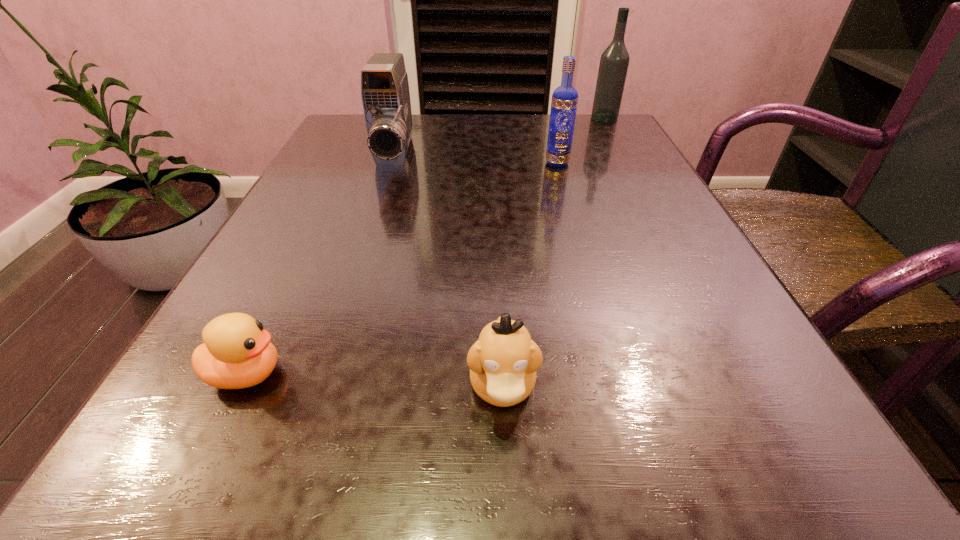
At what (x,y) coordinates should I click in order to perform the action: click on vacant region that satisfies the following two spatial constraints: 1. at the front of the camcorder, highlighting the lens; 2. on the face of the left duckling. Please return your answer as a coordinate pair (x, y). The height and width of the screenshot is (540, 960). Looking at the image, I should click on (324, 374).